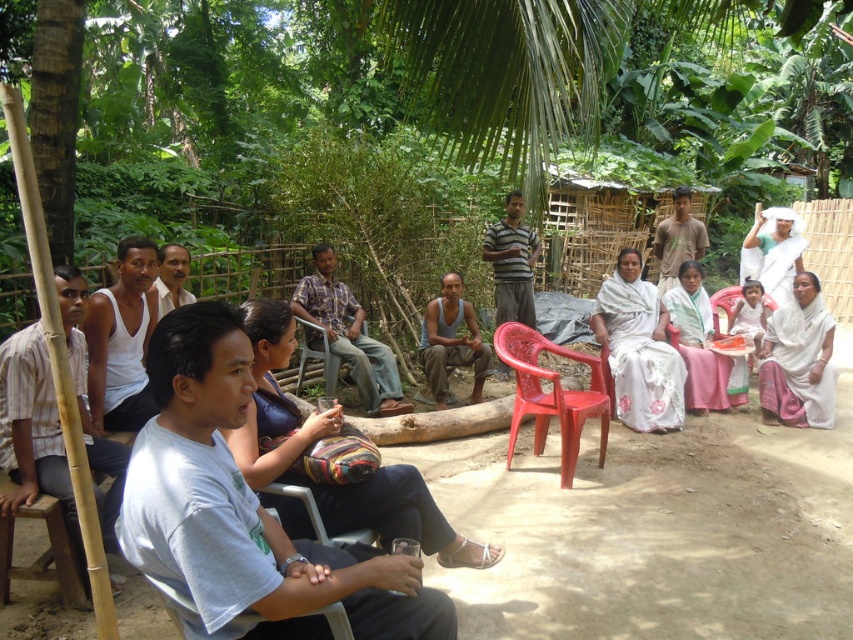
Between striped cotton shirt at left and green cotton shirt at center, which one is positioned lower?

striped cotton shirt at left is below.

Is point (49, 410) positioned behind point (680, 241)?

No, it is not.

You are a GUI agent. You are given a task and a screenshot of the screen. Output one action in this format:
    pyautogui.click(x=<x>, y=<y>)
    Task: Click on the striped cotton shirt at left
    The height and width of the screenshot is (640, 853).
    Given the screenshot: What is the action you would take?
    pyautogui.click(x=32, y=429)

Is white cloth at lower right closer to camera compared to wooden stool at lower left?

That is False.

Consider the image. Which is more to the left, white cloth at lower right or wooden stool at lower left?

From the viewer's perspective, wooden stool at lower left appears more on the left side.

Between point (793, 339) and point (0, 563), which one is positioned in front?

Point (0, 563) is more forward.

Locate an element on the screen. This screenshot has width=853, height=640. white cloth at lower right is located at coordinates (798, 360).

Consider the image. Who is positioned more to the right, striped cotton shirt at left or white woven saree at center?

Positioned to the right is white woven saree at center.

Which is in front, point (78, 412) or point (624, 300)?

Positioned in front is point (78, 412).

Where is `striped cotton shirt at left`? striped cotton shirt at left is located at coordinates (32, 429).